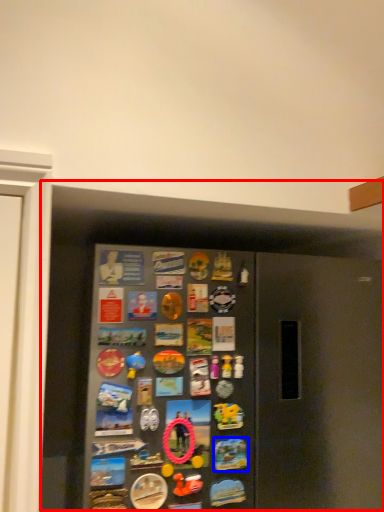
Question: Among these objects, which one is nearest to the camera, fridge (highlighted by a red box) or button (highlighted by a blue box)?

Choices:
 (A) fridge
 (B) button

Answer: (A)